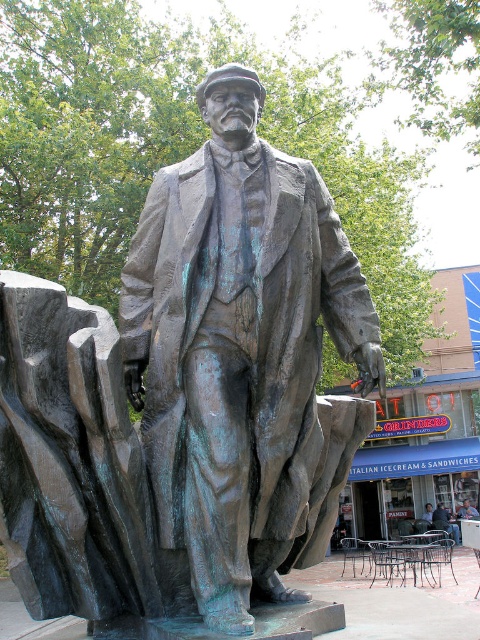
Question: Is bronze statue at center above matte bronze statue at center?

Choices:
 (A) no
 (B) yes

Answer: (B)

Question: Can you confirm if bronze statue at center is bigger than matte bronze statue at center?

Choices:
 (A) yes
 (B) no

Answer: (A)

Question: Among these objects, which one is farthest from the camera?

Choices:
 (A) matte bronze statue at center
 (B) bronze statue at center

Answer: (A)

Question: Which of the following is the closest to the observer?

Choices:
 (A) bronze statue at center
 (B) matte bronze statue at center

Answer: (A)

Question: Is bronze statue at center above matte bronze statue at center?

Choices:
 (A) yes
 (B) no

Answer: (A)